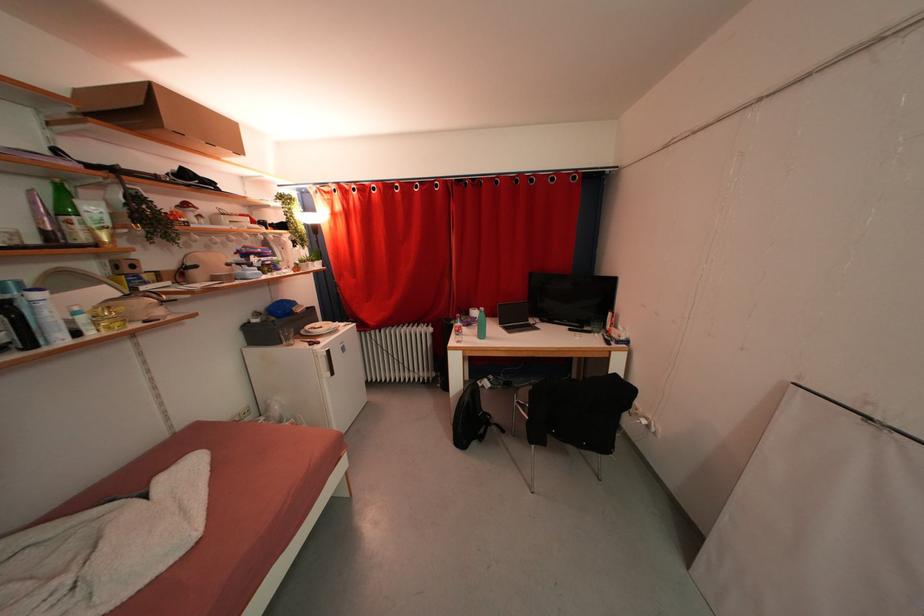
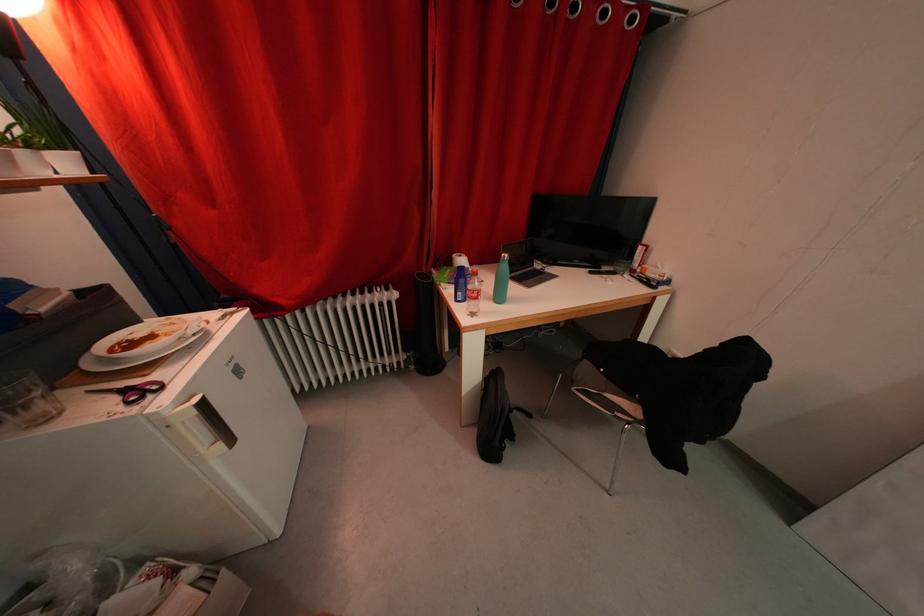
Where in the second image is the point corresponding to pixel 462 328 from the first image?

(476, 291)